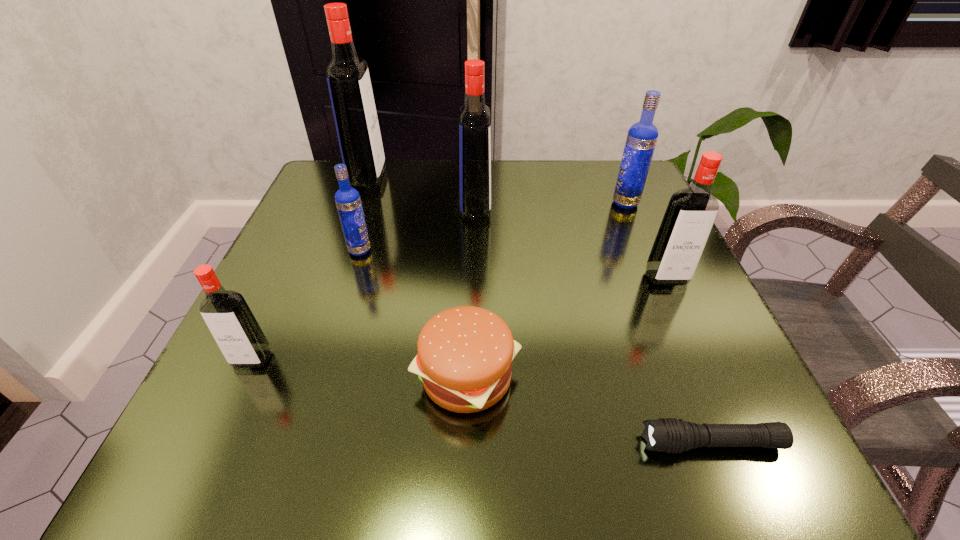
You are a GUI agent. You are given a task and a screenshot of the screen. Output one action in this format:
    pyautogui.click(x=<x>, y=<y>)
    Task: Click on the tallest object
    The height and width of the screenshot is (540, 960).
    Given the screenshot: What is the action you would take?
    pyautogui.click(x=349, y=84)

What are the coordinates of `the farthest vodka` in the screenshot? It's located at (349, 84).

Find the location of a particular element. This screenshot has height=540, width=960. the seventh shortest object is located at coordinates (474, 122).

This screenshot has height=540, width=960. I want to click on the fourth vodka from left to right, so click(x=474, y=122).

The image size is (960, 540). Find the location of `the bigger blue vodka`. the bigger blue vodka is located at coordinates click(642, 136).

Identify the location of the farther blue vodka. (642, 136).

Locate an element on the screen. the fifth farthest object is located at coordinates (691, 212).

The image size is (960, 540). I want to click on the fifth farthest vodka, so click(691, 212).

Where is `the nearer blue vodka`? Image resolution: width=960 pixels, height=540 pixels. the nearer blue vodka is located at coordinates pos(348,202).

You are a GUI agent. You are given a task and a screenshot of the screen. Output one action in this format:
    pyautogui.click(x=<x>, y=<y>)
    Task: Click on the fourth farthest object
    
    Given the screenshot: What is the action you would take?
    pyautogui.click(x=348, y=202)